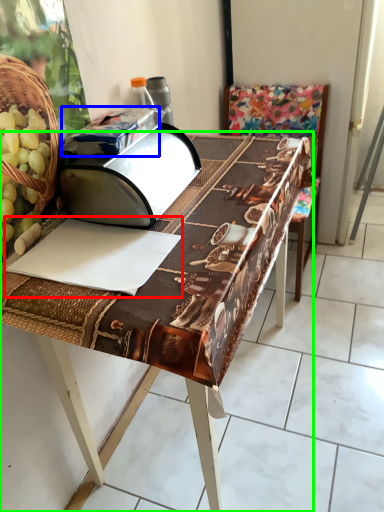
Question: Which object is the closest to the wrapping paper (highlighted by a red box)? Choose among these: wrapping paper (highlighted by a blue box) or table (highlighted by a green box).

Choices:
 (A) wrapping paper
 (B) table

Answer: (B)